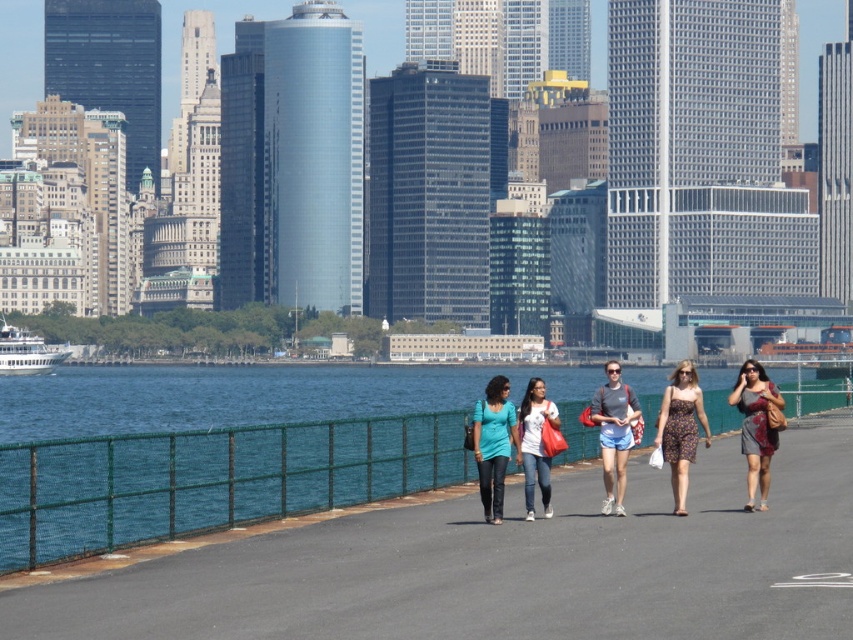
Is matte teal shirt at center to the right of matte gray t-shirt at center from the viewer's perspective?

In fact, matte teal shirt at center is to the left of matte gray t-shirt at center.

Is point (502, 388) in front of point (606, 376)?

Yes.

Where is `matte teal shirt at center`? The height and width of the screenshot is (640, 853). matte teal shirt at center is located at coordinates (492, 444).

Is floral print dress at center to the left of printed fabric dress at center right from the viewer's perspective?

Yes, floral print dress at center is to the left of printed fabric dress at center right.

Which of these two, floral print dress at center or printed fabric dress at center right, stands taller?

With more height is printed fabric dress at center right.

In order to click on floral print dress at center in this screenshot , I will do `click(680, 428)`.

Can you confirm if asphalt at center is smaller than matte teal shirt at center?

Actually, asphalt at center might be larger than matte teal shirt at center.

Is point (706, 452) closer to viewer compared to point (491, 452)?

No.

The image size is (853, 640). Find the location of `asphalt at center`. asphalt at center is located at coordinates (508, 564).